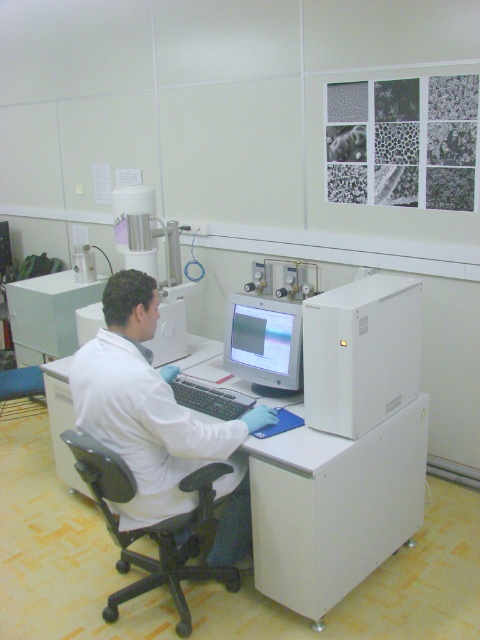
Question: Can you confirm if white lab coat at center is positioned to the right of black plastic chair at lower left?

Choices:
 (A) yes
 (B) no

Answer: (A)

Question: Is white lab coat at center bigger than matte gray monitor at center?

Choices:
 (A) no
 (B) yes

Answer: (B)

Question: Which object is farther from the camera taking this photo?

Choices:
 (A) white lab coat at center
 (B) matte gray monitor at center
 (C) white plastic computer desk at center

Answer: (B)

Question: Which object is positioned closest to the white plastic computer desk at center?

Choices:
 (A) matte gray monitor at center
 (B) black plastic chair at lower left
 (C) white lab coat at center

Answer: (C)

Question: Is the position of white matte computer at right more distant than that of matte gray monitor at center?

Choices:
 (A) no
 (B) yes

Answer: (A)

Question: Among these objects, which one is farthest from the camera?

Choices:
 (A) white plastic computer desk at center
 (B) black plastic chair at lower left

Answer: (A)